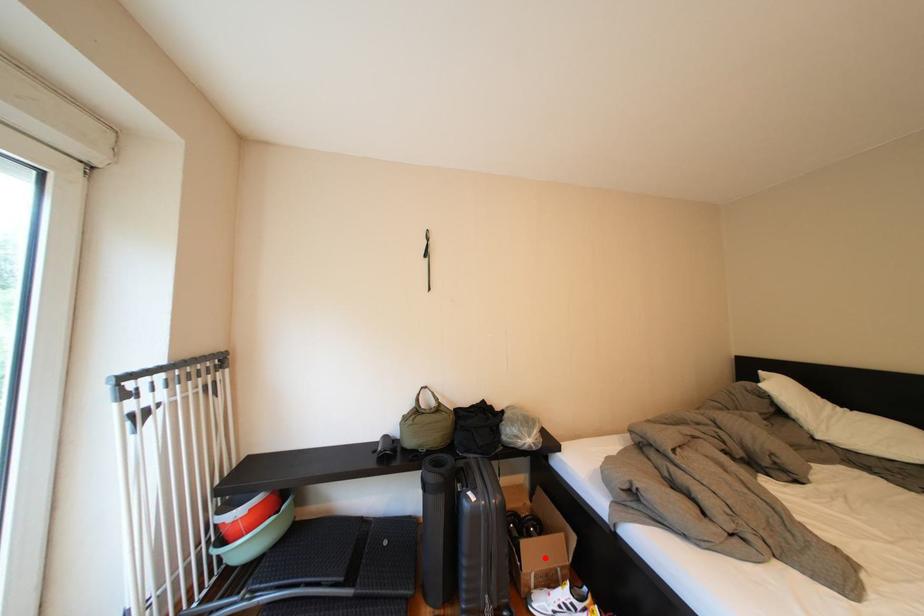
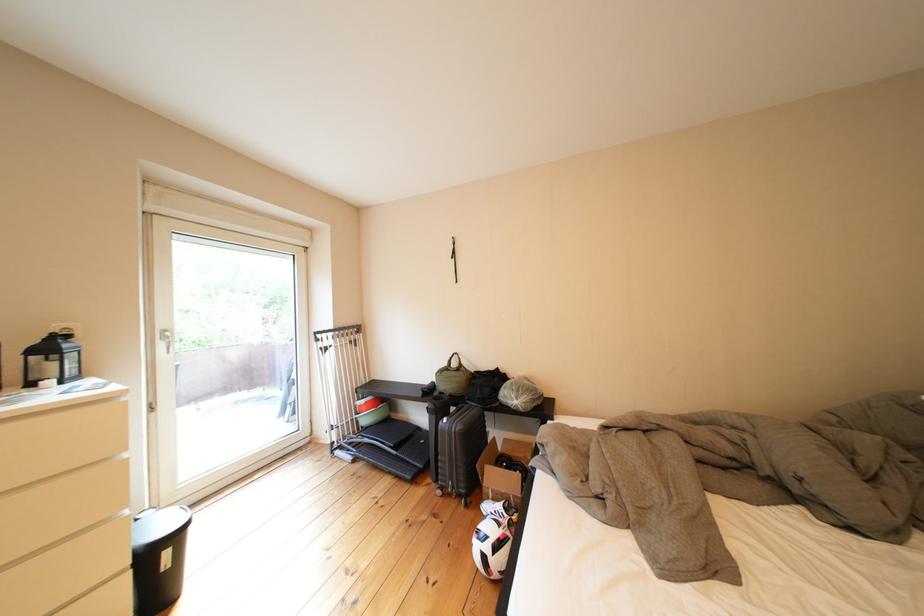
In the second image, find the point that corresponds to the highlighted location in the first image.

(505, 480)